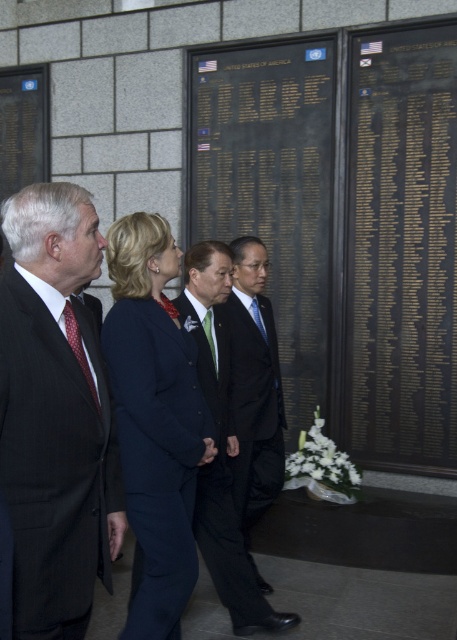
Between dark gray suit at left and navy blue suit at center, which one appears on the left side from the viewer's perspective?

From the viewer's perspective, dark gray suit at left appears more on the left side.

Is dark gray suit at left thinner than navy blue suit at center?

Yes, dark gray suit at left is thinner than navy blue suit at center.

Between point (11, 385) and point (170, 392), which one is positioned in front?

Point (11, 385) is in front.

Find the location of a particular element. The width and height of the screenshot is (457, 640). dark gray suit at left is located at coordinates (56, 413).

Does navy blue suit at center appear under black glossy suit at center?

Actually, navy blue suit at center is above black glossy suit at center.

Between navy blue suit at center and black glossy suit at center, which one is positioned lower?

black glossy suit at center

Who is more forward, (196, 397) or (271, 426)?

Positioned in front is point (196, 397).

Where is `navy blue suit at center`? The image size is (457, 640). navy blue suit at center is located at coordinates (154, 420).

Measure the distance between black glossy suit at center and polka dot silk tie at left.

They are 1.52 meters apart.

Is point (271, 380) positioned in front of point (64, 323)?

No, (271, 380) is further to viewer.

What are the coordinates of `black glossy suit at center` in the screenshot? It's located at (254, 392).

This screenshot has height=640, width=457. I want to click on black glossy suit at center, so click(x=254, y=392).